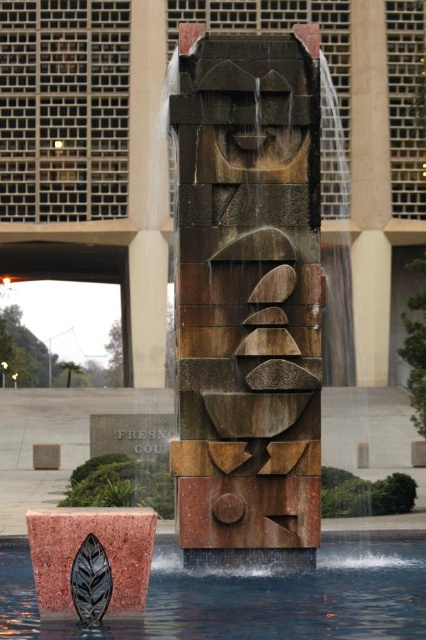
You are a maintenance worker needing to clean both the rustic stone face at center and the metallic water at leaf bottom. If you start at the sculpture base, which object should you reach first?

The rustic stone face at center should be reached first since it is closer to the sculpture base than the metallic water at leaf bottom, which is farther away.